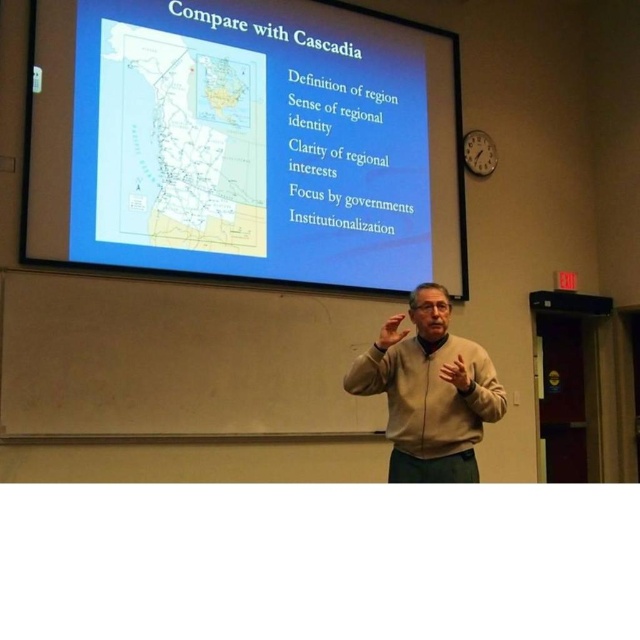
Question: Among these points, which one is nearest to the camera?

Choices:
 (A) (278, 202)
 (B) (424, 460)

Answer: (B)

Question: Can you confirm if white matte projection screen at upper center is positioned below beige sweater at center?

Choices:
 (A) no
 (B) yes

Answer: (A)

Question: Which point is farther to the camera?

Choices:
 (A) (234, 188)
 (B) (390, 420)

Answer: (A)

Question: In this image, where is white matte projection screen at upper center located relative to beige sweater at center?

Choices:
 (A) left
 (B) right

Answer: (A)

Question: Where is white matte projection screen at upper center located in relation to beige sweater at center in the image?

Choices:
 (A) right
 (B) left

Answer: (B)

Question: Which object appears farthest from the camera in this image?

Choices:
 (A) beige sweater at center
 (B) white matte projection screen at upper center

Answer: (B)